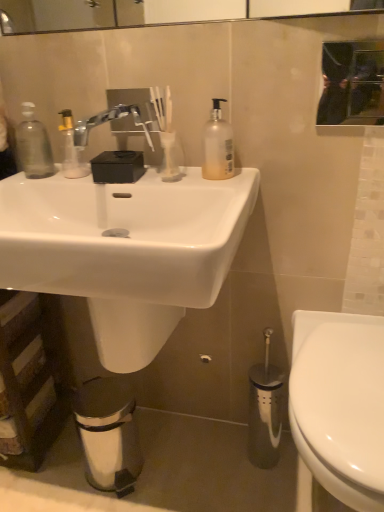
Question: Is satin nickel faucet at upper center thinner than black glass mirror at upper center?

Choices:
 (A) no
 (B) yes

Answer: (A)

Question: Does satin nickel faucet at upper center appear on the left side of black glass mirror at upper center?

Choices:
 (A) yes
 (B) no

Answer: (A)

Question: Considering the relative sizes of satin nickel faucet at upper center and black glass mirror at upper center in the image provided, is satin nickel faucet at upper center taller than black glass mirror at upper center?

Choices:
 (A) yes
 (B) no

Answer: (B)

Question: Would you say black glass mirror at upper center is part of satin nickel faucet at upper center's contents?

Choices:
 (A) no
 (B) yes

Answer: (A)

Question: From the image's perspective, is satin nickel faucet at upper center above black glass mirror at upper center?

Choices:
 (A) yes
 (B) no

Answer: (B)

Question: Is translucent plastic pump bottle at upper center spatially inside white glossy sink at center, or outside of it?

Choices:
 (A) outside
 (B) inside

Answer: (A)

Question: From a real-world perspective, is translucent plastic pump bottle at upper center positioned above or below white glossy sink at center?

Choices:
 (A) above
 (B) below

Answer: (A)

Question: Is translucent plastic pump bottle at upper center wider or thinner than white glossy sink at center?

Choices:
 (A) thin
 (B) wide

Answer: (A)

Question: In terms of height, does translucent plastic pump bottle at upper center look taller or shorter compared to white glossy sink at center?

Choices:
 (A) tall
 (B) short

Answer: (B)

Question: Looking at the image, does transparent plastic soap dispenser at left seem bigger or smaller compared to black glass mirror at upper center?

Choices:
 (A) big
 (B) small

Answer: (B)

Question: Considering the positions of point (29, 144) and point (339, 113), is point (29, 144) closer or farther from the camera than point (339, 113)?

Choices:
 (A) closer
 (B) farther

Answer: (B)

Question: Considering the positions of transparent plastic soap dispenser at left and black glass mirror at upper center in the image, is transparent plastic soap dispenser at left taller or shorter than black glass mirror at upper center?

Choices:
 (A) tall
 (B) short

Answer: (A)

Question: Relative to black glass mirror at upper center, is transparent plastic soap dispenser at left in front or behind?

Choices:
 (A) front
 (B) behind

Answer: (B)

Question: Is point (342, 73) closer or farther from the camera than point (46, 247)?

Choices:
 (A) closer
 (B) farther

Answer: (B)

Question: In the image, is black glass mirror at upper center positioned in front of or behind white glossy sink at center?

Choices:
 (A) front
 (B) behind

Answer: (B)